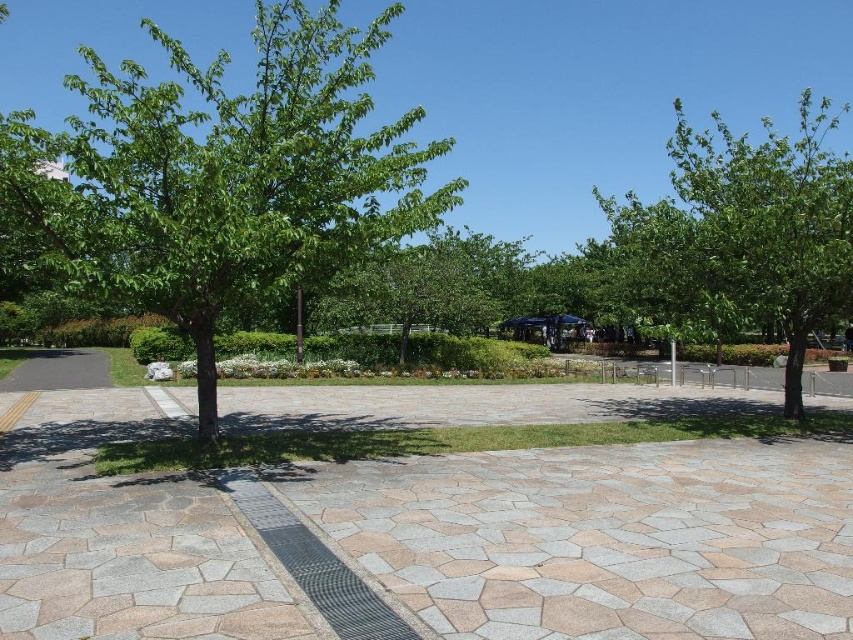
Looking at this image, which is below, green leafy tree at right or wooden park bench at center?

wooden park bench at center

Which is behind, point (827, 278) or point (654, 381)?

The point (654, 381) is more distant.

Image resolution: width=853 pixels, height=640 pixels. I want to click on green leafy tree at right, so click(741, 236).

Is green leafy tree at left wider than green leafy tree at right?

In fact, green leafy tree at left might be narrower than green leafy tree at right.

Where is `green leafy tree at left`? This screenshot has width=853, height=640. green leafy tree at left is located at coordinates (224, 176).

Is green leafy tree at right taller than metallic gray path at center?

Yes, green leafy tree at right is taller than metallic gray path at center.

Describe the element at coordinates (741, 236) in the screenshot. I see `green leafy tree at right` at that location.

Who is more distant from viewer, (608,240) or (283,515)?

Positioned behind is point (608,240).

Where is `green leafy tree at right`? green leafy tree at right is located at coordinates (741, 236).